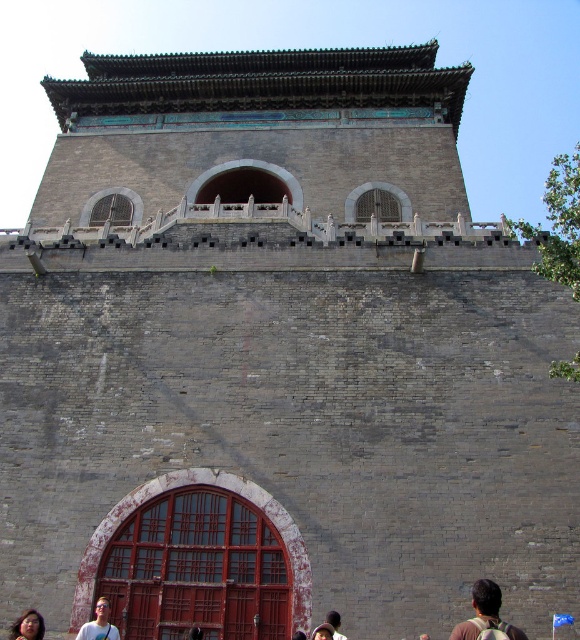
You are a traveler carrying both the brown backpack at lower center and the brown leather backpack at lower center. You need to pass through a narrow doorway that only allows one backpack at a time. Which backpack should you leave behind to ensure you can carry the other through the doorway?

The brown leather backpack at lower center is smaller in size compared to the brown backpack at lower center. To ensure passage through the narrow doorway, you should leave the larger brown backpack at lower center behind and carry the smaller brown leather backpack at lower center through the doorway.

You are a tourist visiting this historical site and have both a brown leather backpack at lower center and a brown leather hat at lower center with you. Which item would block your view more if you were to place them in front of you at the same position?

The brown leather backpack at lower center is much taller than the brown leather hat at lower center, so placing the backpack would block your view more.